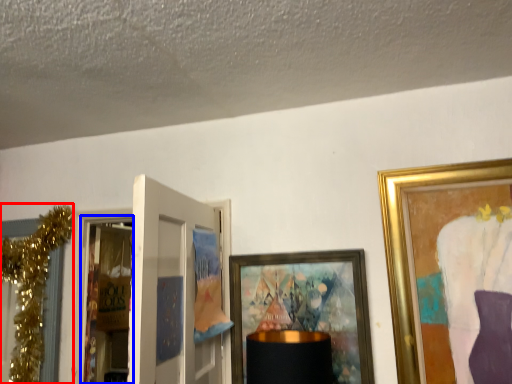
Question: Which point is closer to the camera, christmas decoration (highlighted by a red box) or screen door (highlighted by a blue box)?

Choices:
 (A) christmas decoration
 (B) screen door

Answer: (A)